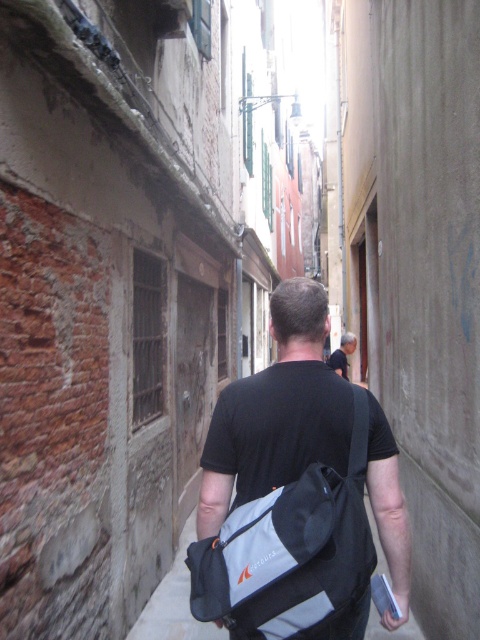
You are a delivery person carrying a gray fabric bag at center and a dark gray shirt at center. You need to pass through a doorway that is 1.5 meters tall. Which item might require bending down to avoid hitting your head?

The gray fabric bag at center is not as tall as the dark gray shirt at center, so the dark gray shirt at center is taller and might require bending down to avoid hitting your head.

You are a delivery person carrying a package and need to pass through the narrow alleyway. You see a black fabric bag at center and a dark gray shirt at center in your path. Which object is taller and might require you to bend down to avoid hitting your head?

The black fabric bag at center is taller than the dark gray shirt at center, so you would need to bend down to avoid hitting your head on the black fabric bag at center.